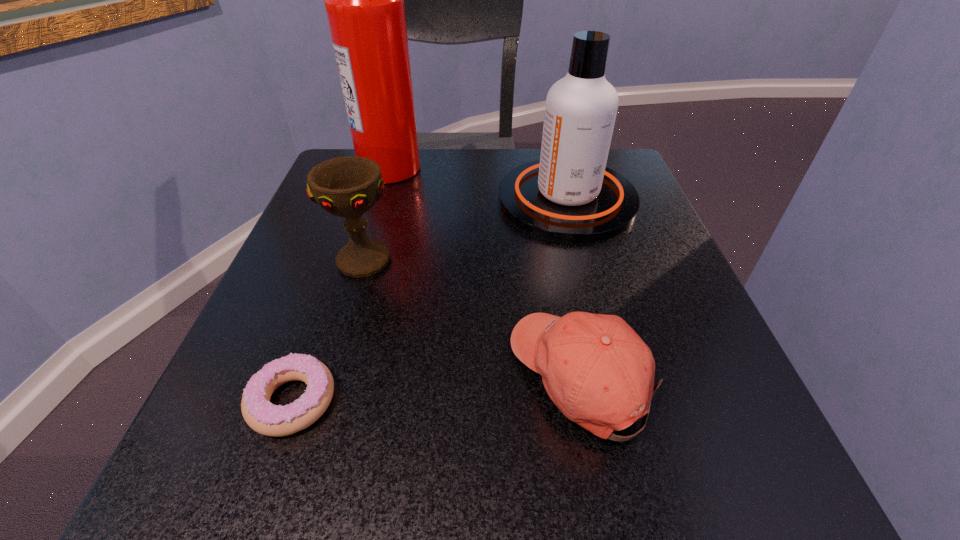
This screenshot has width=960, height=540. Find the location of `object that is at the near left corner`. object that is at the near left corner is located at coordinates (260, 414).

Locate an element on the screen. The image size is (960, 540). object that is at the far right corner is located at coordinates (569, 195).

Identify the location of object at the near right corner. The width and height of the screenshot is (960, 540). (596, 369).

The width and height of the screenshot is (960, 540). Identify the location of vacant space at the far edge of the desktop. (529, 154).

What are the coordinates of `free space at the near edge of the desktop` in the screenshot? It's located at (398, 492).

Find the location of a particular element. blank space at the left edge of the desktop is located at coordinates (318, 249).

At what (x,y) coordinates should I click in order to perform the action: click on vacant space at the right edge. Please return your answer as a coordinate pair (x, y). Looking at the image, I should click on (651, 430).

You are a GUI agent. You are given a task and a screenshot of the screen. Output one action in this format:
    pyautogui.click(x=<x>, y=<y>)
    Task: Click on the free point at the near left corner
    The height and width of the screenshot is (540, 960).
    Given the screenshot: What is the action you would take?
    pyautogui.click(x=305, y=478)

You are a GUI agent. You are given a task and a screenshot of the screen. Output one action in this format:
    pyautogui.click(x=<x>, y=<y>)
    Task: Click on the vacant space at the near right corner of the desktop
    
    Given the screenshot: What is the action you would take?
    pyautogui.click(x=747, y=511)

Where is `free space between the third tallest object and the fire extinguisher`? free space between the third tallest object and the fire extinguisher is located at coordinates (377, 214).